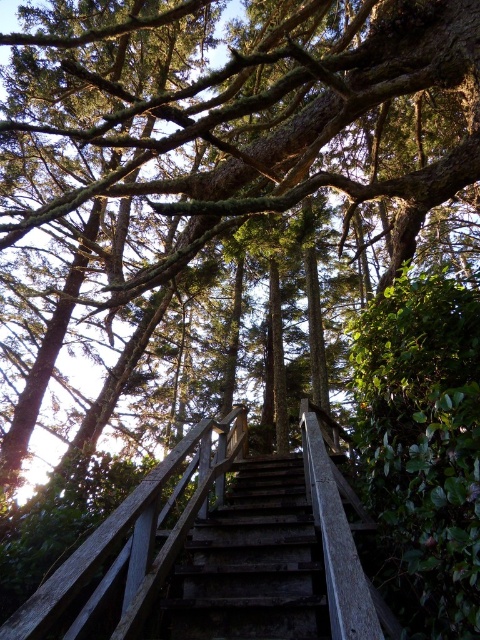
Is point (175, 474) farther from camera compared to point (248, 636)?

Yes, point (175, 474) is behind point (248, 636).

The width and height of the screenshot is (480, 640). Find the location of `wooden rail at center`. wooden rail at center is located at coordinates (223, 548).

The height and width of the screenshot is (640, 480). In order to click on wooden rail at center in this screenshot , I will do `click(223, 548)`.